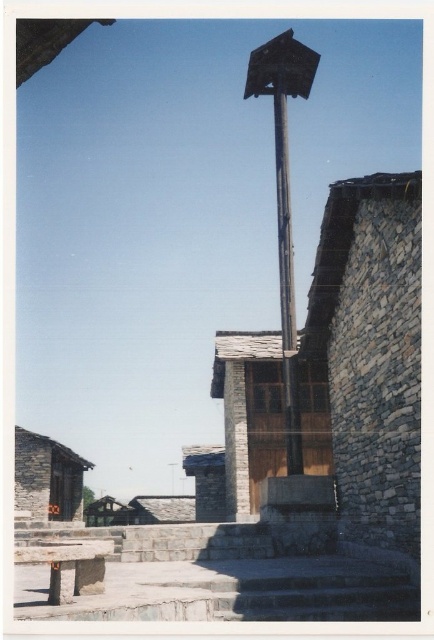
Question: Among these points, which one is nearest to the camera?

Choices:
 (A) (53, 476)
 (B) (246, 502)
 (C) (243, 364)

Answer: (B)

Question: Which object is farther from the camera taking this photo?

Choices:
 (A) wooden hut at lower left
 (B) wooden hut at center

Answer: (A)

Question: Where is wooden hut at center located in relation to wooden post at center in the image?

Choices:
 (A) right
 (B) left

Answer: (B)

Question: In this image, where is metallic pole at center located relative to wooden hut at lower left?

Choices:
 (A) right
 (B) left

Answer: (A)

Question: Does metallic pole at center have a larger size compared to wooden hut at lower left?

Choices:
 (A) yes
 (B) no

Answer: (A)

Question: Which object appears closest to the camera in this image?

Choices:
 (A) smooth stone pillar at center
 (B) wooden hut at center

Answer: (B)